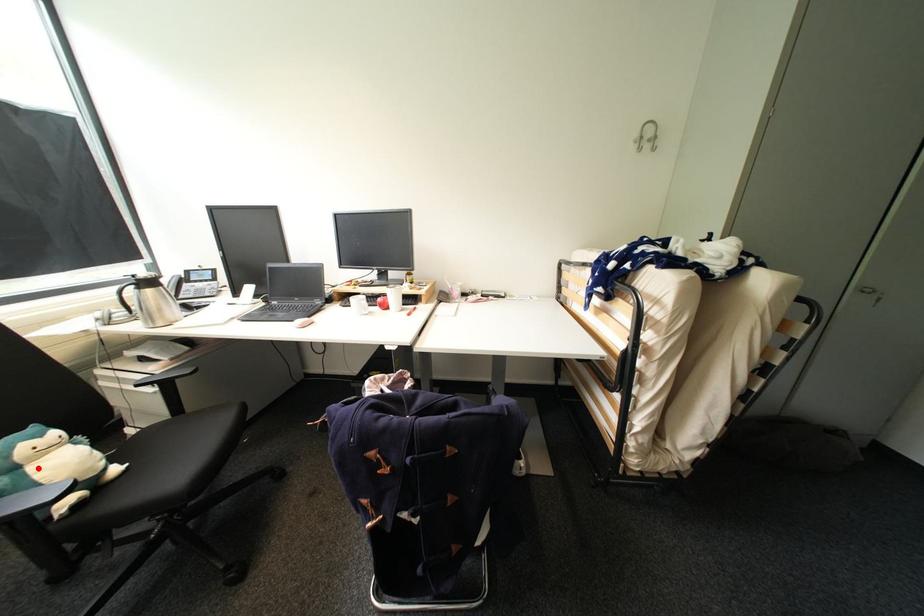
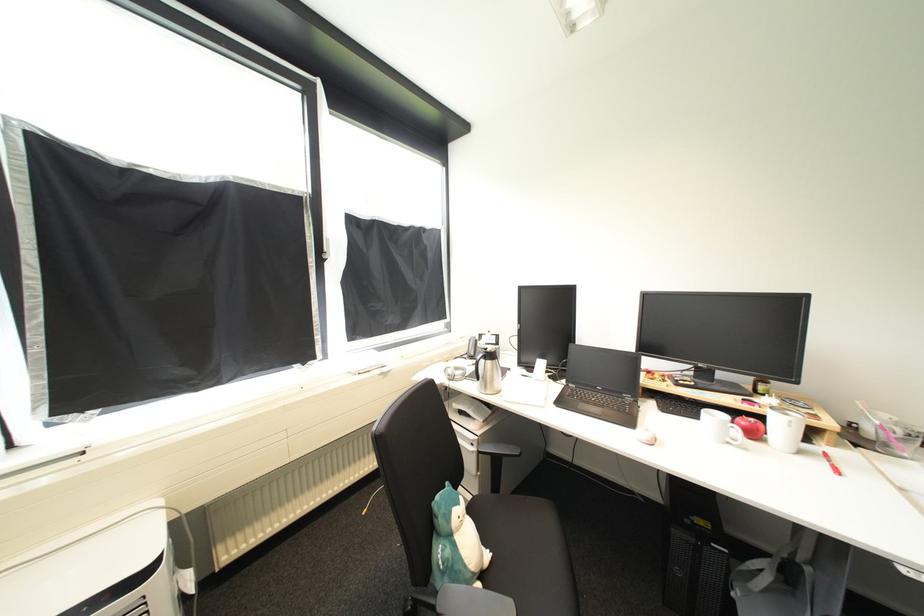
The point at the highlighted location is marked in the first image. Where is the corresponding point in the second image?

(464, 538)